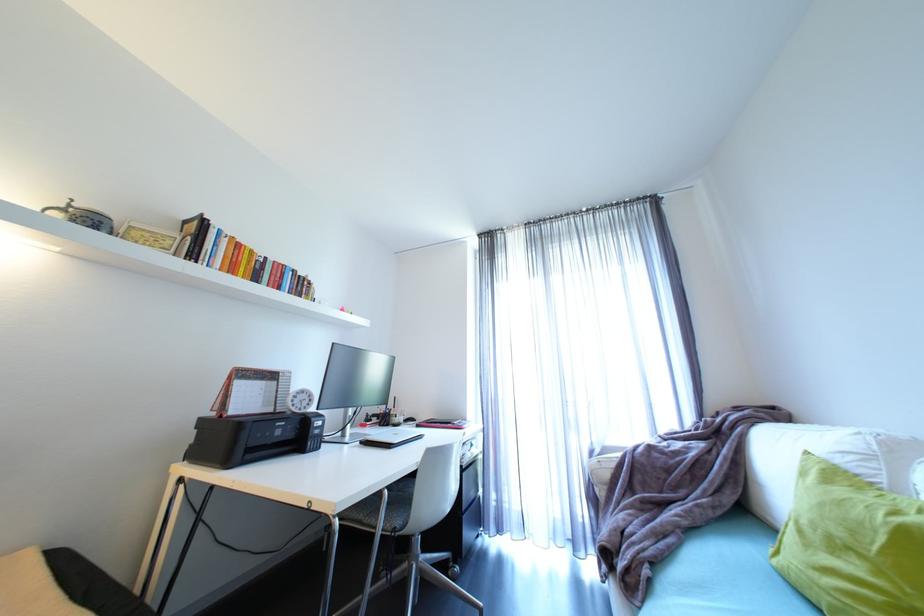
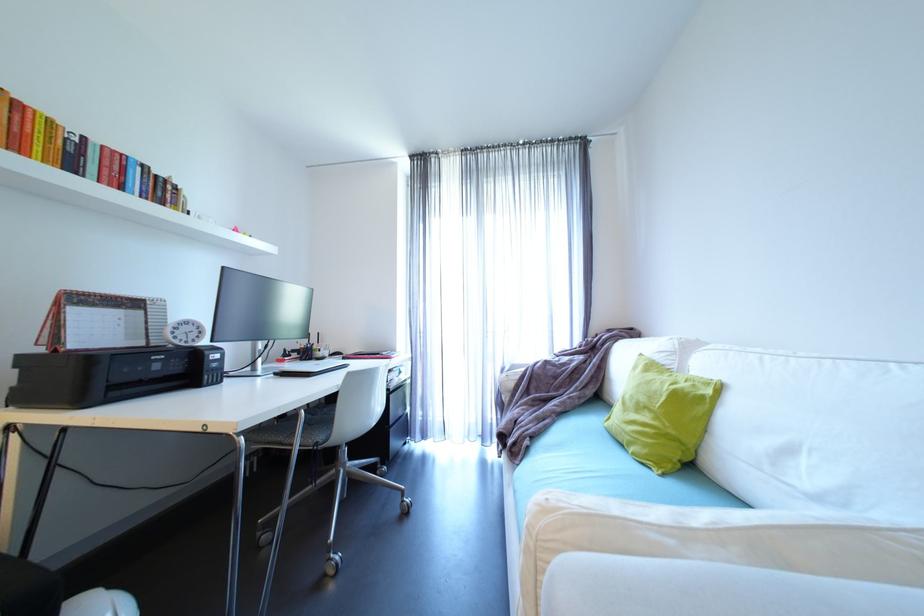
Question: What movement of the cameraman would produce the second image?

Choices:
 (A) Left
 (B) Right
 (C) Forward
 (D) Backward

Answer: (B)